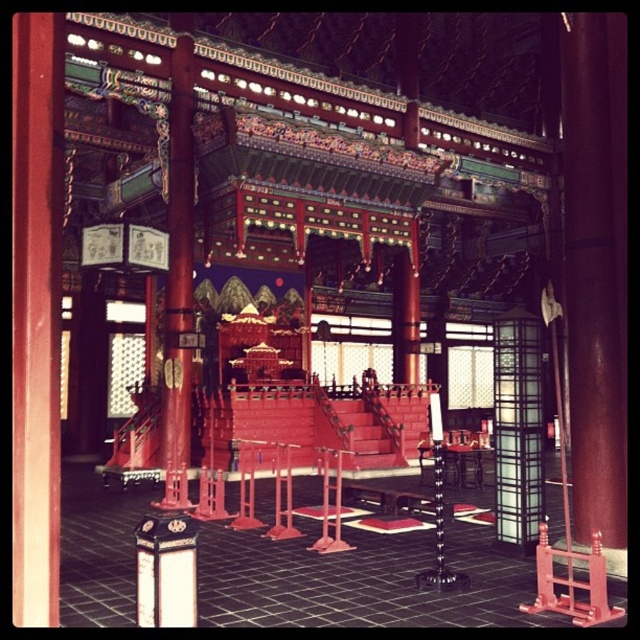
Which of these two, smooth polished wood pole at left or black glass lantern at center, stands taller?

With more height is black glass lantern at center.

Who is positioned more to the right, smooth polished wood pole at left or black glass lantern at center?

Positioned to the right is black glass lantern at center.

Between point (180, 323) and point (499, 442), which one is positioned in front?

Point (499, 442) is more forward.

Where is `smooth polished wood pole at left`? smooth polished wood pole at left is located at coordinates (179, 278).

Does smooth wood pillar at center have a lesser width compared to smooth polished wood pole at left?

Yes, smooth wood pillar at center is thinner than smooth polished wood pole at left.

Between smooth wood pillar at center and smooth polished wood pole at left, which one is positioned higher?

Positioned higher is smooth wood pillar at center.

What do you see at coordinates (596, 273) in the screenshot? This screenshot has height=640, width=640. I see `smooth wood pillar at center` at bounding box center [596, 273].

Identify the location of smooth wood pillar at center. This screenshot has width=640, height=640. (596, 273).

Is smooth wood pillar at center shorter than black glass lantern at center?

In fact, smooth wood pillar at center may be taller than black glass lantern at center.

Is smooth wood pillar at center bigger than black glass lantern at center?

Correct, smooth wood pillar at center is larger in size than black glass lantern at center.

Is point (614, 312) positioned behind point (493, 392)?

No.

I want to click on smooth wood pillar at center, so click(596, 273).